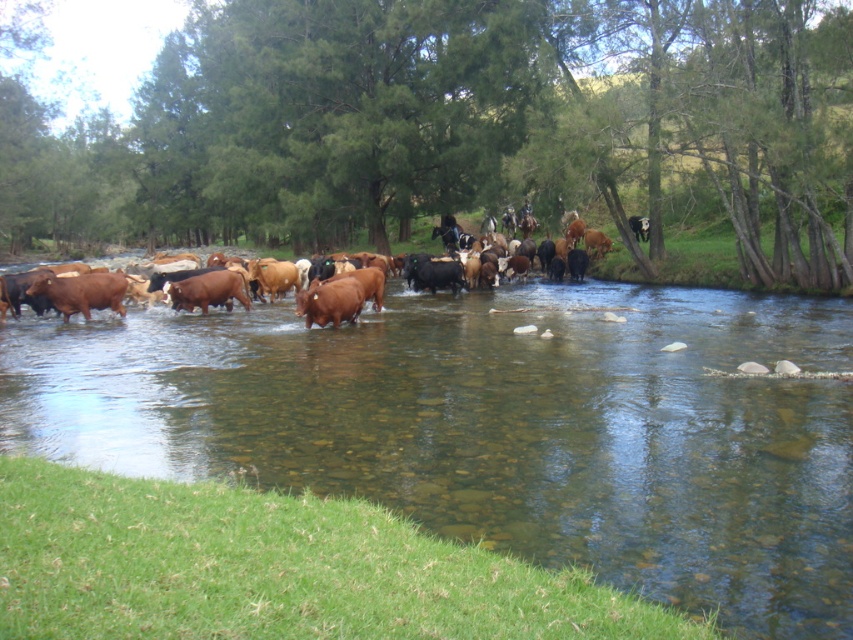
You are standing on the riverbank observing the cattle crossing the river. You notice two points marked in the scene. Which point is closer to you, point (113, 461) or point (189, 269)?

Point (113, 461) is closer to the viewer than point (189, 269).

You are standing at the point marked as point (329, 301) in the image. What object is located at this point?

The point (329, 301) corresponds to the brown matte cow at center.

Consider the image. You are a farmer observing the herd crossing the river. You notice the brown matte cow at center and the brown glossy cows at center. Which group is positioned lower in the river? Please answer based on their spatial relationship.

The brown matte cow at center is located below the brown glossy cows at center, meaning it is positioned lower in the river.